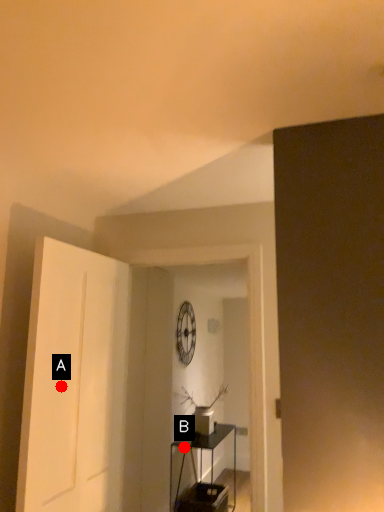
Question: Two points are circled on the image, labeled by A and B beside each circle. Which point is farther to the camera?

Choices:
 (A) A is further
 (B) B is further

Answer: (B)